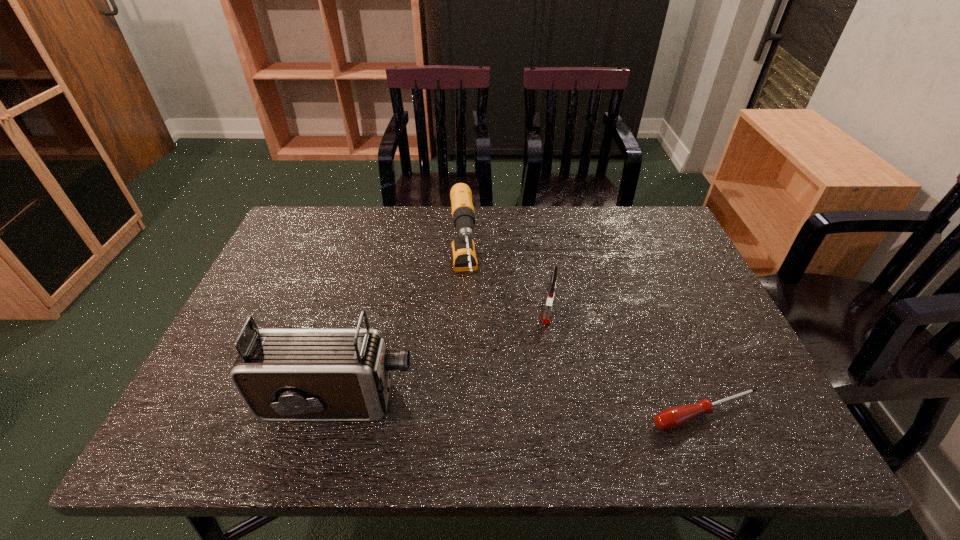
Find the location of a particular element. The width and height of the screenshot is (960, 540). vacant point that satisfies the following two spatial constraints: 1. on the front side of the rightmost object; 2. on the left side of the drill is located at coordinates (458, 413).